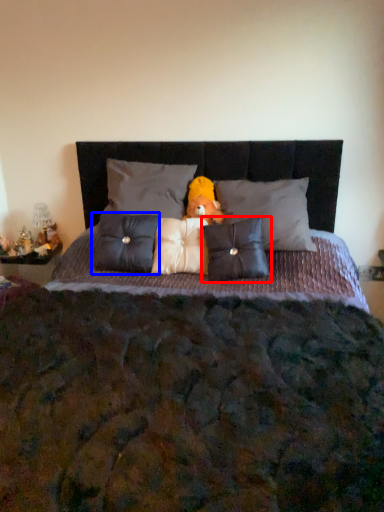
Question: Which object is further to the camera taking this photo, pillow (highlighted by a red box) or pillow (highlighted by a blue box)?

Choices:
 (A) pillow
 (B) pillow

Answer: (B)